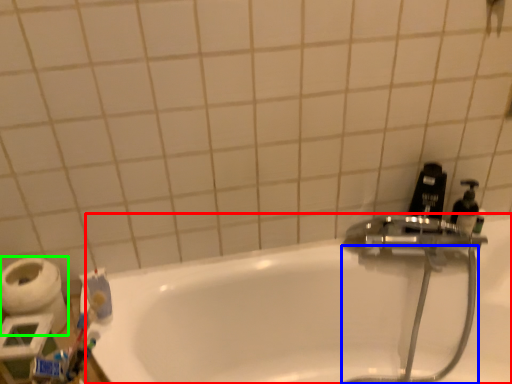
Question: Considering the real-world distances, which object is closest to bathtub (highlighted by a red box)? garden hose (highlighted by a blue box) or toilet paper (highlighted by a green box).

Choices:
 (A) garden hose
 (B) toilet paper

Answer: (A)